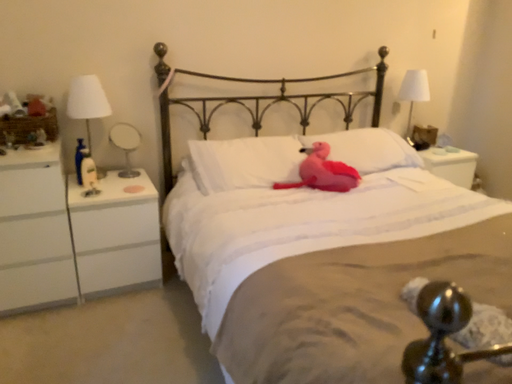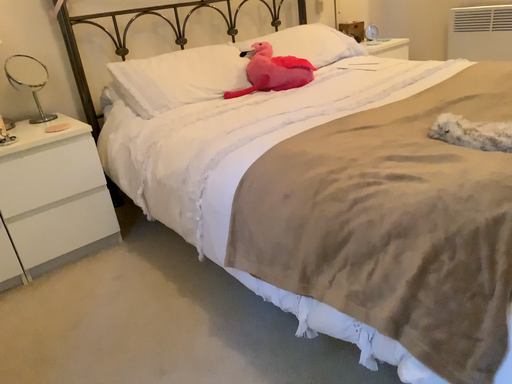
Question: How did the camera likely rotate when shooting the video?

Choices:
 (A) rotated right
 (B) rotated left

Answer: (A)